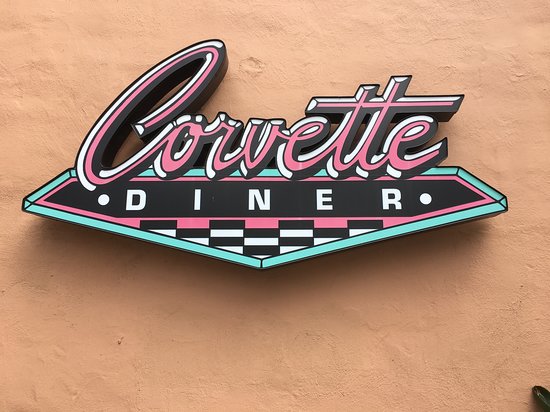
Locate an element on the screen. crater in table surface is located at coordinates (251, 69).